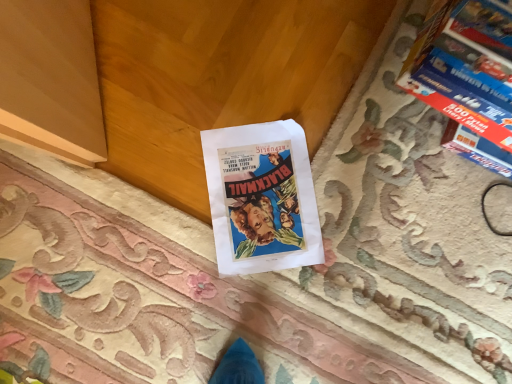
Identify the location of free space above vintage paper poster at center (from a real-world perspective). Image resolution: width=512 pixels, height=384 pixels. (273, 210).